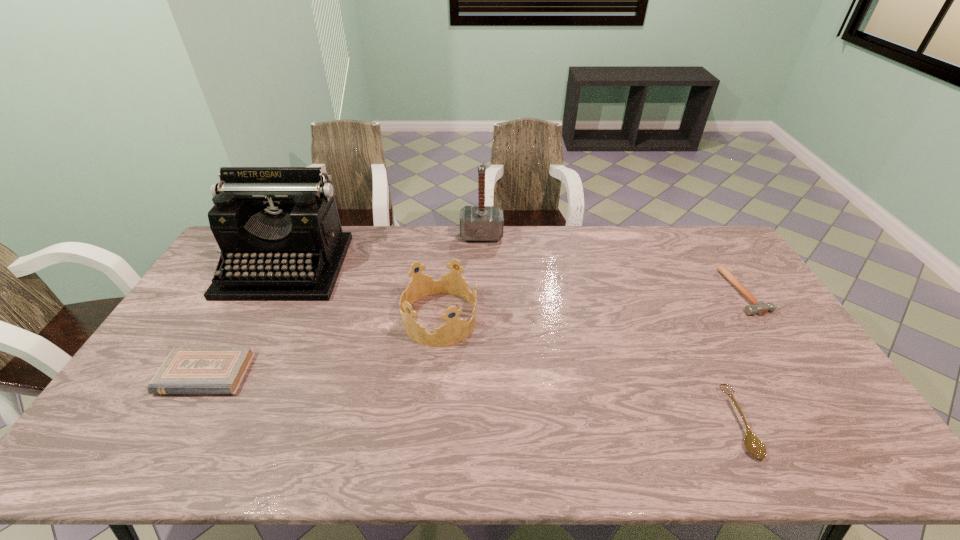
You are a GUI agent. You are given a task and a screenshot of the screen. Output one action in this format:
    pyautogui.click(x=<x>, y=<y>)
    Task: Click on the object at the right edge
    The height and width of the screenshot is (540, 960).
    Given the screenshot: What is the action you would take?
    pyautogui.click(x=761, y=308)

Where is `object situated at the far left corner`? Image resolution: width=960 pixels, height=540 pixels. object situated at the far left corner is located at coordinates (278, 228).

This screenshot has width=960, height=540. I want to click on free location at the far edge of the desktop, so click(x=401, y=250).

This screenshot has height=540, width=960. In order to click on vacant space at the near edge in this screenshot , I will do `click(755, 464)`.

Locate an element on the screen. vacant space at the left edge is located at coordinates (207, 280).

This screenshot has width=960, height=540. Identify the location of vacant space at the right edge of the desktop. (731, 272).

Where is `vacant space at the far right corner of the desktop`? This screenshot has width=960, height=540. vacant space at the far right corner of the desktop is located at coordinates (723, 246).

I want to click on empty space that is in between the ladle and the typewriter, so click(513, 345).

At what (x,y) coordinates should I click in order to perform the action: click on free space between the tiara and the shortest object. Please return your answer as a coordinate pair (x, y). The height and width of the screenshot is (540, 960). Looking at the image, I should click on (589, 370).

At what (x,y) coordinates should I click in order to perform the action: click on free space between the Bible and the third tallest object. Please return your answer as a coordinate pair (x, y). Looking at the image, I should click on (323, 346).